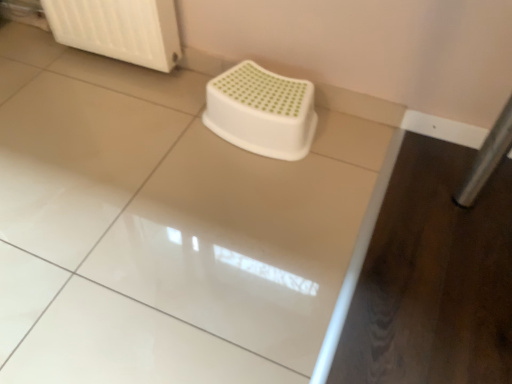
This screenshot has width=512, height=384. I want to click on vacant space situated above white plastic stool at center (from a real-world perspective), so click(259, 97).